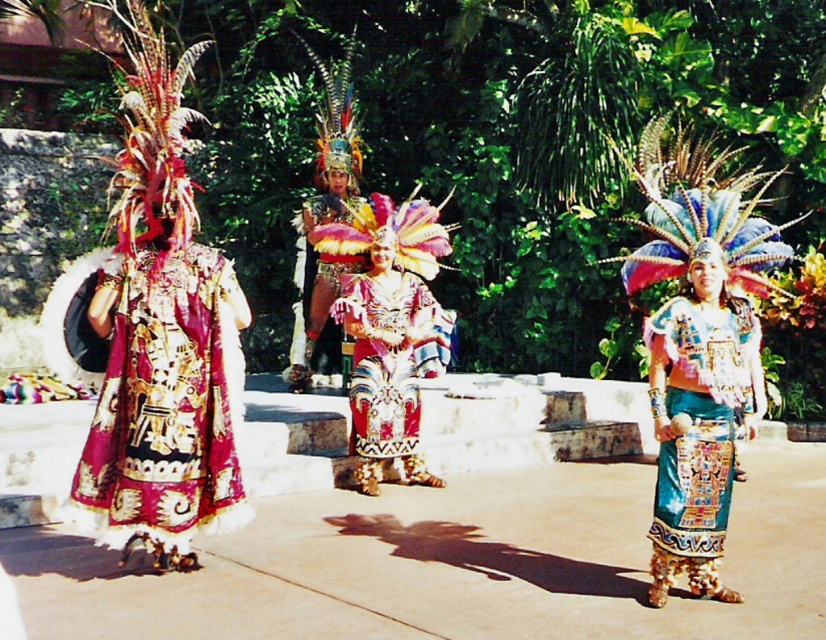
You are standing in the scene and notice a point at coordinates (165,401). Which object is this point located on?

The point at coordinates (165,401) is located on the rich velvet dress at left.

You are a photographer planning to capture a closeup of the rich velvet dress at left and the shiny teal skirt at center. Since you want to focus on one subject, which object should you choose to ensure it fills the frame better due to its size?

The rich velvet dress at left is bigger than the shiny teal skirt at center, so you should choose the rich velvet dress at left to fill the frame better.